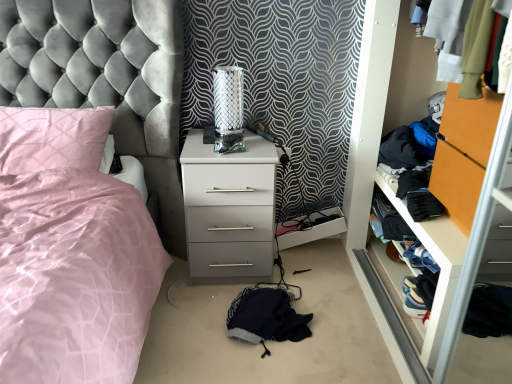
Question: From a real-world perspective, is denim fabric clothes at right positioned over satin pink bed at left based on gravity?

Choices:
 (A) yes
 (B) no

Answer: (B)

Question: Is denim fabric clothes at right to the right of satin pink bed at left from the viewer's perspective?

Choices:
 (A) no
 (B) yes

Answer: (B)

Question: Is the position of denim fabric clothes at right less distant than that of satin pink bed at left?

Choices:
 (A) no
 (B) yes

Answer: (A)

Question: Is denim fabric clothes at right thinner than satin pink bed at left?

Choices:
 (A) no
 (B) yes

Answer: (B)

Question: Does denim fabric clothes at right appear on the left side of satin pink bed at left?

Choices:
 (A) no
 (B) yes

Answer: (A)

Question: Is point (36, 165) closer or farther from the camera than point (223, 79)?

Choices:
 (A) closer
 (B) farther

Answer: (A)

Question: Looking at the image, does pink satin pillow at left seem bigger or smaller compared to metallic mesh table lamp at center?

Choices:
 (A) small
 (B) big

Answer: (B)

Question: Based on their positions, is pink satin pillow at left located to the left or right of metallic mesh table lamp at center?

Choices:
 (A) right
 (B) left

Answer: (B)

Question: Considering their positions, is pink satin pillow at left located in front of or behind metallic mesh table lamp at center?

Choices:
 (A) front
 (B) behind

Answer: (A)

Question: Is black fleece gloves at right, which is the first clothing from top to bottom, in front of or behind white glossy chest of drawers at center in the image?

Choices:
 (A) behind
 (B) front

Answer: (A)

Question: In terms of size, does black fleece gloves at right, the 2th clothing positioned from the left, appear bigger or smaller than white glossy chest of drawers at center?

Choices:
 (A) small
 (B) big

Answer: (A)

Question: Considering the positions of black fleece gloves at right, which is the first clothing from top to bottom, and white glossy chest of drawers at center in the image, is black fleece gloves at right, which is the first clothing from top to bottom, wider or thinner than white glossy chest of drawers at center?

Choices:
 (A) thin
 (B) wide

Answer: (A)

Question: Is black fleece gloves at right, the 2th clothing positioned from the left, inside or outside of white glossy chest of drawers at center?

Choices:
 (A) inside
 (B) outside

Answer: (B)

Question: From their relative heights in the image, would you say fuzzy dark blue blanket at lower center, the third clothing from the right, is taller or shorter than black fleece gloves at right, the 2th clothing positioned from the left?

Choices:
 (A) tall
 (B) short

Answer: (A)

Question: In terms of width, does fuzzy dark blue blanket at lower center, which is the 3th clothing from top to bottom, look wider or thinner when compared to black fleece gloves at right, the 2th clothing positioned from the left?

Choices:
 (A) thin
 (B) wide

Answer: (B)